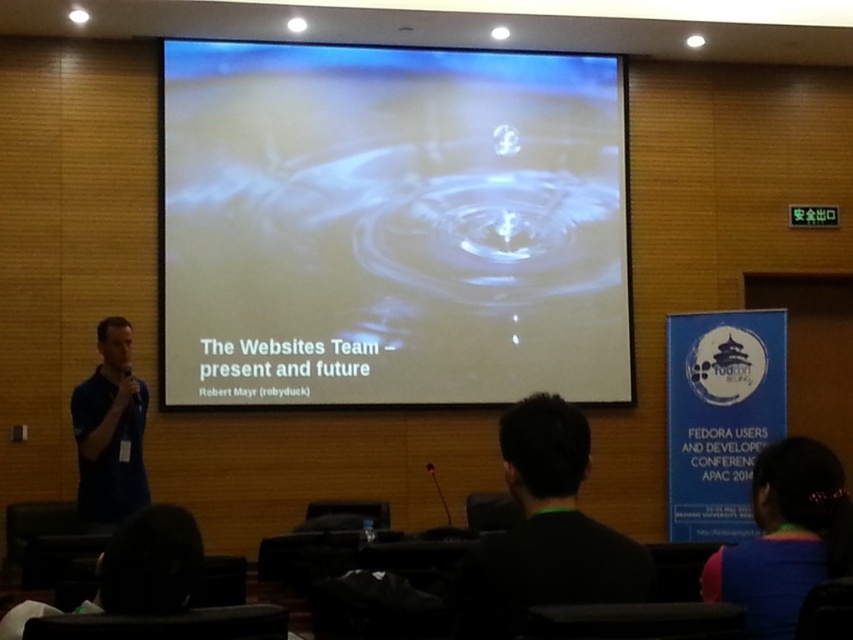
Question: Which point is closer to the camera?

Choices:
 (A) (498, 557)
 (B) (836, 461)

Answer: (A)

Question: Based on their relative distances, which object is farther from the transparent liquid droplets at center?

Choices:
 (A) dark blue shirt at left
 (B) rainbow fabric shirt at lower right

Answer: (B)

Question: Is transparent liquid droplets at center thinner than dark blue shirt at left?

Choices:
 (A) no
 (B) yes

Answer: (A)

Question: Which of these objects is positioned closest to the rainbow fabric shirt at lower right?

Choices:
 (A) black matte shirt at center
 (B) dark blue shirt at left
 (C) transparent liquid droplets at center

Answer: (A)

Question: Is transparent liquid droplets at center further to camera compared to rainbow fabric shirt at lower right?

Choices:
 (A) yes
 (B) no

Answer: (A)

Question: Is transparent liquid droplets at center to the right of dark blue shirt at left from the viewer's perspective?

Choices:
 (A) no
 (B) yes

Answer: (B)